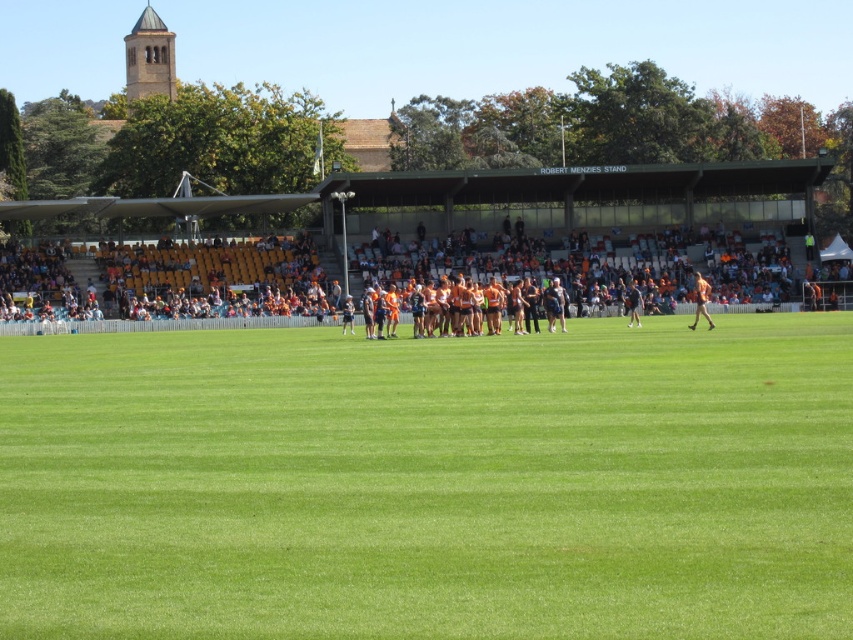
In the sports field scene, there are an orange jersey at center and an orange uniformed person at center. Which object is taller?

The orange jersey at center is much taller than the orange uniformed person at center.

You are a photographer trying to capture a photo of the orange uniformed person at center while ensuring the green grass field at center is visible in the background. Based on their heights, can you fit both in the frame without cropping either?

The green grass field at center is not as tall as the orange uniformed person at center, so the grass field will appear shorter in the photo. Since the person is taller, you can position the camera to include the full height of the orange uniformed person at center while still having the green grass field at center visible in the background without cropping either.